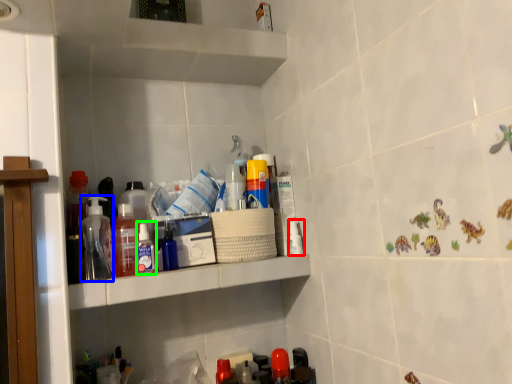
Question: Which object is the farthest from toiletry (highlighted by a red box)? Choose among these: bottle (highlighted by a blue box) or toiletry (highlighted by a green box).

Choices:
 (A) bottle
 (B) toiletry

Answer: (A)